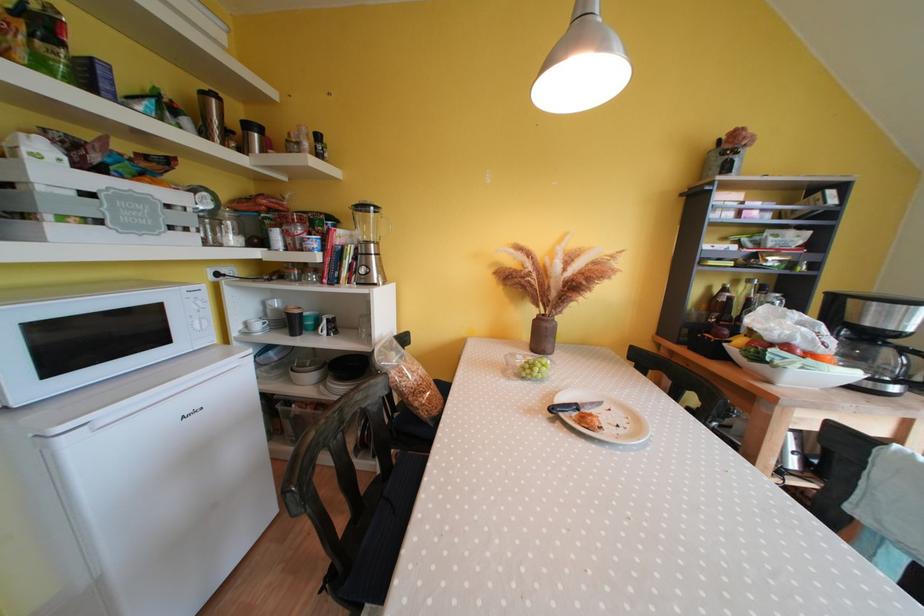
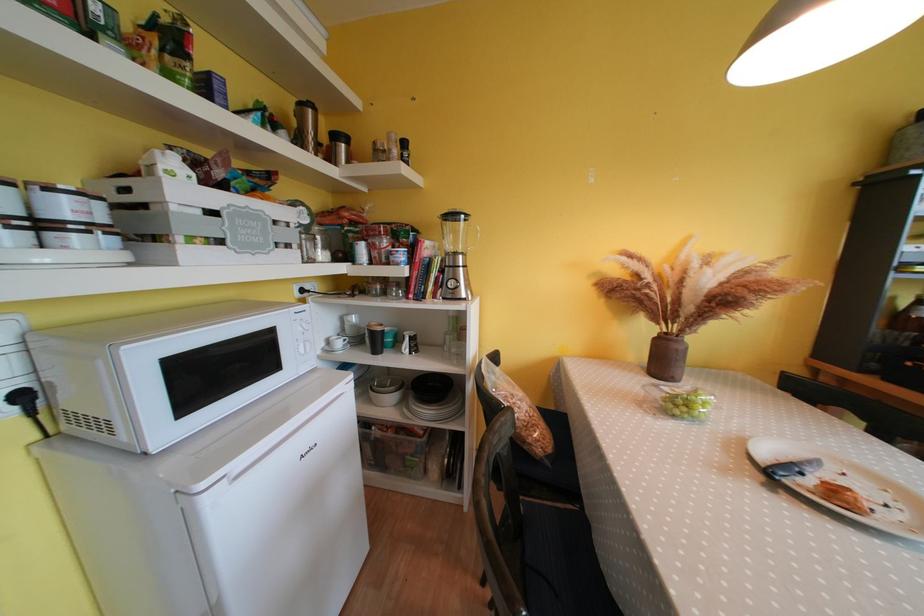
In the second image, find the point that corresponds to the point at 554,330 in the first image.

(687, 351)